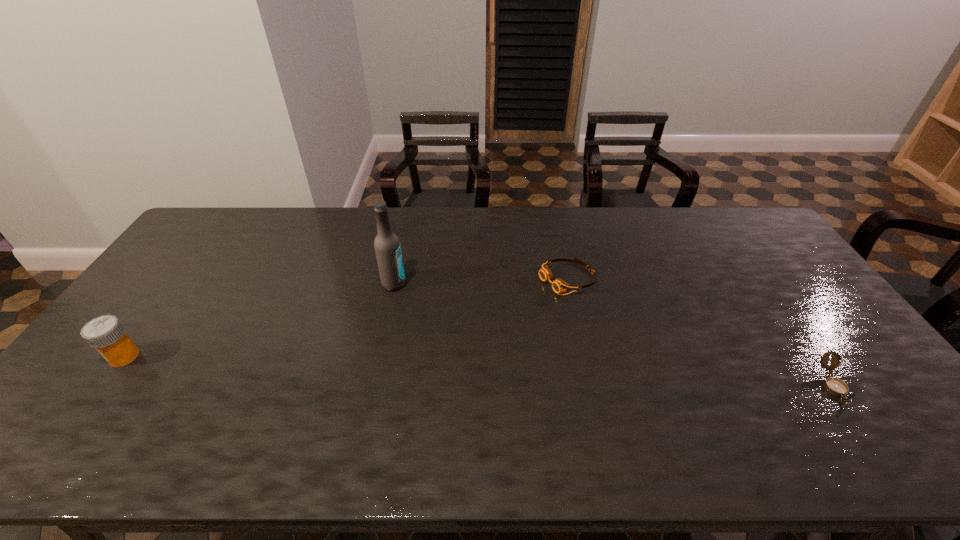
You are a GUI agent. You are given a task and a screenshot of the screen. Output one action in this format:
    pyautogui.click(x=<x>, y=<y>)
    Task: Click on the free area in between the second object from right to left and the third shortest object
    The width and height of the screenshot is (960, 540).
    Given the screenshot: What is the action you would take?
    (x=346, y=317)

In order to click on free space that is in between the third object from left to right and the rightmost object in this screenshot , I will do `click(700, 332)`.

This screenshot has width=960, height=540. Find the location of `the second closest object to the shortest object`. the second closest object to the shortest object is located at coordinates (835, 386).

Where is `the second closest object to the rightmost object`? the second closest object to the rightmost object is located at coordinates (387, 247).